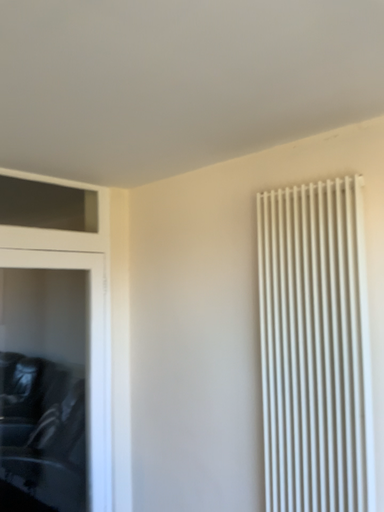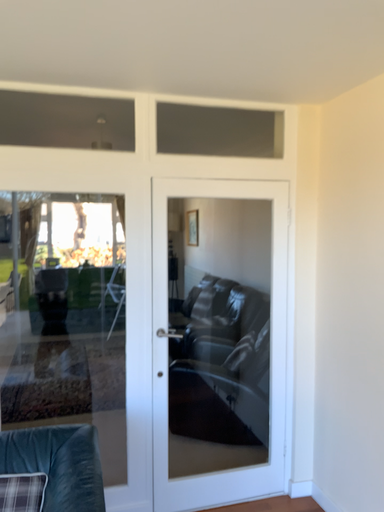
Question: Which way did the camera rotate in the video?

Choices:
 (A) rotated downward
 (B) rotated upward

Answer: (A)